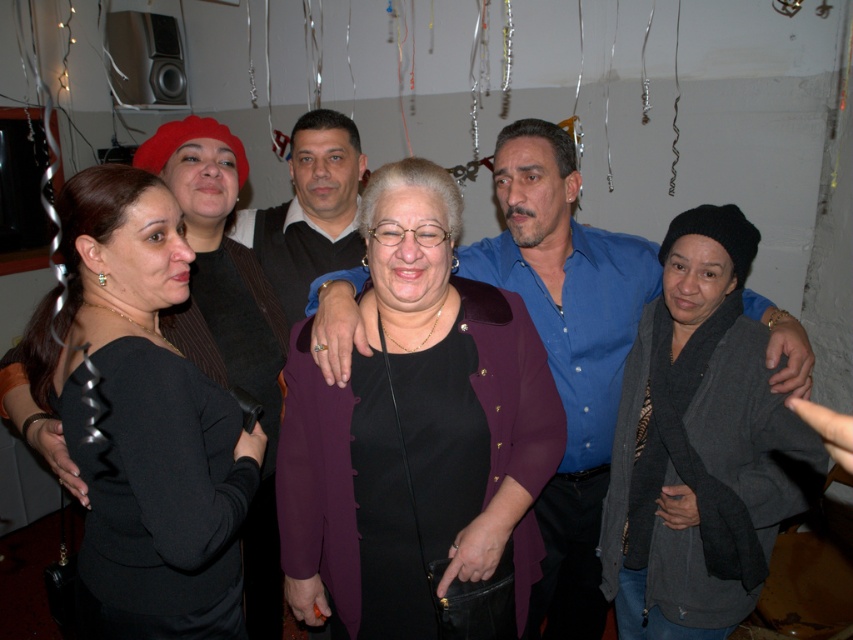
Is purple matte jacket at center bigger than dark gray woolen scarf at center?

No.

Who is more distant from viewer, (x=442, y=525) or (x=822, y=465)?

The point (x=822, y=465) is more distant.

Who is more forward, (531, 524) or (814, 454)?

Point (531, 524) is in front.

This screenshot has height=640, width=853. What are the coordinates of `purple matte jacket at center` in the screenshot? It's located at (415, 428).

Locate an element on the screen. dark gray woolen scarf at center is located at coordinates pos(699,445).

Locate an element on the screen. The image size is (853, 640). dark gray woolen scarf at center is located at coordinates (699, 445).

Between dark gray woolen scarf at center and blue smooth shirt at center, which one is positioned higher?

blue smooth shirt at center is higher up.

Is dark gray woolen scarf at center shorter than blue smooth shirt at center?

Indeed, dark gray woolen scarf at center has a lesser height compared to blue smooth shirt at center.

Image resolution: width=853 pixels, height=640 pixels. What are the coordinates of `dark gray woolen scarf at center` in the screenshot? It's located at (699, 445).